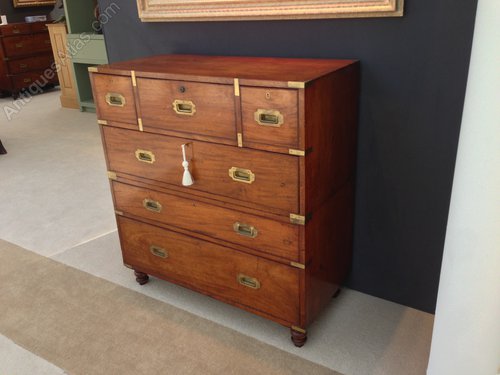
You are a GUI agent. You are given a task and a screenshot of the screen. Output one action in this format:
    pyautogui.click(x=<x>, y=<y>)
    Task: Click on the handle
    The height and width of the screenshot is (375, 500).
    Given the screenshot: What is the action you would take?
    pyautogui.click(x=244, y=281)